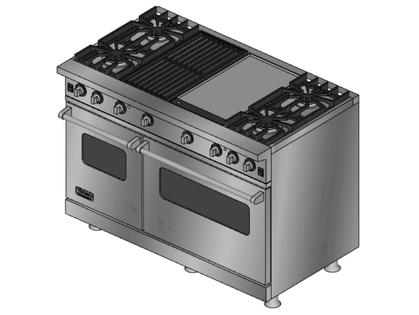
In order to click on handle for oven on left in this screenshot , I will do `click(101, 132)`.